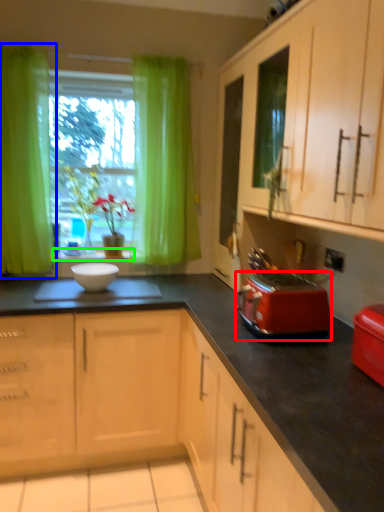
Question: Which object is the farthest from kitchen appliance (highlighted by a red box)? Choose among these: curtain (highlighted by a blue box) or window sill (highlighted by a green box).

Choices:
 (A) curtain
 (B) window sill

Answer: (A)